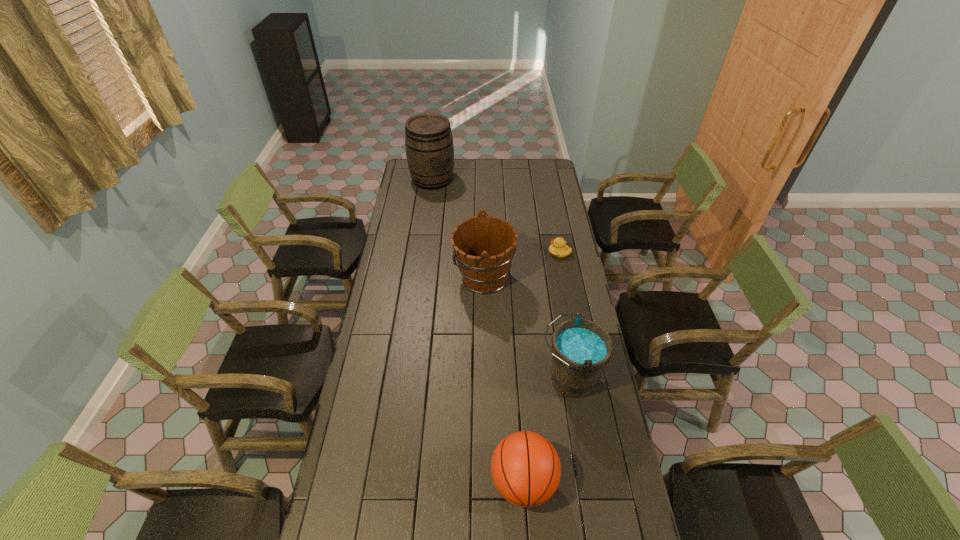
In order to click on vacant region located 0.090m with the handle on the second wine bucket from left to right in this screenshot , I will do `click(433, 278)`.

At what (x,y) coordinates should I click in order to perform the action: click on vacant space situated with the handle on the second wine bucket from left to right. Please return your answer as a coordinate pair (x, y). Looking at the image, I should click on (407, 278).

Locate an element on the screen. This screenshot has width=960, height=540. vacant region located 0.300m with a handle on the side of the nearest wine bucket is located at coordinates (458, 379).

What are the coordinates of `free spot located with a handle on the side of the nearest wine bucket` in the screenshot? It's located at (485, 379).

Locate an element on the screen. This screenshot has height=540, width=960. blank area located 0.310m with a handle on the side of the nearest wine bucket is located at coordinates (455, 379).

Locate an element on the screen. free space located 0.160m on the right of the second shortest object is located at coordinates (608, 482).

Locate an element on the screen. free spot located 0.210m on the front-facing side of the shortest object is located at coordinates (506, 253).

Locate an element on the screen. vacant space situated 0.110m on the front-facing side of the shortest object is located at coordinates coord(526,253).

Where is `vacant space situated 0.170m on the front-facing side of the shortest object`? vacant space situated 0.170m on the front-facing side of the shortest object is located at coordinates (514, 253).

At what (x,y) coordinates should I click in order to perform the action: click on object located at the far edge. Please return your answer as a coordinate pair (x, y). The width and height of the screenshot is (960, 540). Looking at the image, I should click on (429, 146).